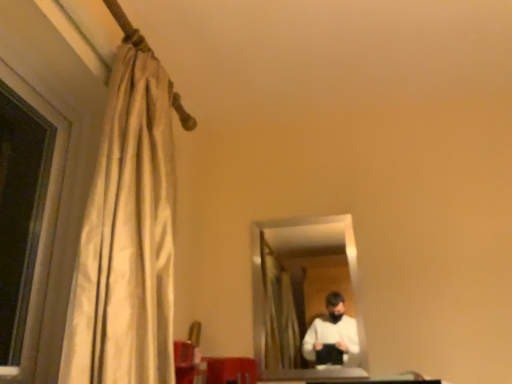
Identify the location of clear glass mirror at center. (305, 294).

Describe the element at coordinates (305, 294) in the screenshot. I see `clear glass mirror at center` at that location.

Based on the photo, measure the distance between clear glass mirror at center and camera.

The depth of clear glass mirror at center is 3.83 meters.

Find the location of a particular element. Image resolution: width=512 pixels, height=384 pixels. beige fabric curtain at left is located at coordinates (128, 233).

Describe the element at coordinates (128, 233) in the screenshot. The image size is (512, 384). I see `beige fabric curtain at left` at that location.

Locate an element on the screen. This screenshot has width=512, height=384. clear glass mirror at center is located at coordinates tap(305, 294).

In the image, is beige fabric curtain at left on the left side or the right side of clear glass mirror at center?

In the image, beige fabric curtain at left appears on the left side of clear glass mirror at center.

Does beige fabric curtain at left lie behind clear glass mirror at center?

No, the depth of beige fabric curtain at left is less than that of clear glass mirror at center.

Is point (157, 83) less distant than point (291, 347)?

Yes.

From the image's perspective, which one is positioned lower, beige fabric curtain at left or clear glass mirror at center?

clear glass mirror at center is shown below in the image.

From a real-world perspective, who is located lower, beige fabric curtain at left or clear glass mirror at center?

In real-world perspective, clear glass mirror at center is lower.

Which object is wider, beige fabric curtain at left or clear glass mirror at center?

Wider between the two is beige fabric curtain at left.

Between beige fabric curtain at left and clear glass mirror at center, which one has less height?

clear glass mirror at center.

Who is bigger, beige fabric curtain at left or clear glass mirror at center?

beige fabric curtain at left is bigger.

Is beige fabric curtain at left not within clear glass mirror at center?

Absolutely, beige fabric curtain at left is external to clear glass mirror at center.

Would you consider beige fabric curtain at left to be distant from clear glass mirror at center?

Yes, beige fabric curtain at left and clear glass mirror at center are quite far apart.

Consider the image. Is clear glass mirror at center at the back of beige fabric curtain at left?

No, beige fabric curtain at left's orientation is not away from clear glass mirror at center.

Locate an element on the screen. This screenshot has width=512, height=384. curtain to the left of clear glass mirror at center is located at coordinates (128, 233).

Which is more to the left, clear glass mirror at center or beige fabric curtain at left?

Positioned to the left is beige fabric curtain at left.

Is the depth of clear glass mirror at center greater than that of beige fabric curtain at left?

Yes, clear glass mirror at center is behind beige fabric curtain at left.

Is point (300, 376) closer or farther from the camera than point (103, 167)?

Clearly, point (300, 376) is more distant from the camera than point (103, 167).

From the image's perspective, relative to beige fabric curtain at left, is clear glass mirror at center above or below?

→ Based on their image positions, clear glass mirror at center is located beneath beige fabric curtain at left.

From a real-world perspective, is clear glass mirror at center beneath beige fabric curtain at left?

Yes, from a real-world perspective, clear glass mirror at center is below beige fabric curtain at left.

Which object is wider, clear glass mirror at center or beige fabric curtain at left?

beige fabric curtain at left.

Between clear glass mirror at center and beige fabric curtain at left, which one has less height?

Standing shorter between the two is clear glass mirror at center.

In terms of size, does clear glass mirror at center appear bigger or smaller than beige fabric curtain at left?

clear glass mirror at center is smaller than beige fabric curtain at left.

Would you say beige fabric curtain at left is part of clear glass mirror at center's contents?

No, beige fabric curtain at left is located outside of clear glass mirror at center.

Is clear glass mirror at center directly adjacent to beige fabric curtain at left?

They are not placed beside each other.

Is clear glass mirror at center oriented away from beige fabric curtain at left?

No.

Where is `curtain that is above the clear glass mirror at center (from the image's perspective)`? The image size is (512, 384). curtain that is above the clear glass mirror at center (from the image's perspective) is located at coordinates (128, 233).

Find the location of a particular element. mirror on the right of beige fabric curtain at left is located at coordinates (305, 294).

What are the coordinates of `mirror behind the beige fabric curtain at left` in the screenshot? It's located at (305, 294).